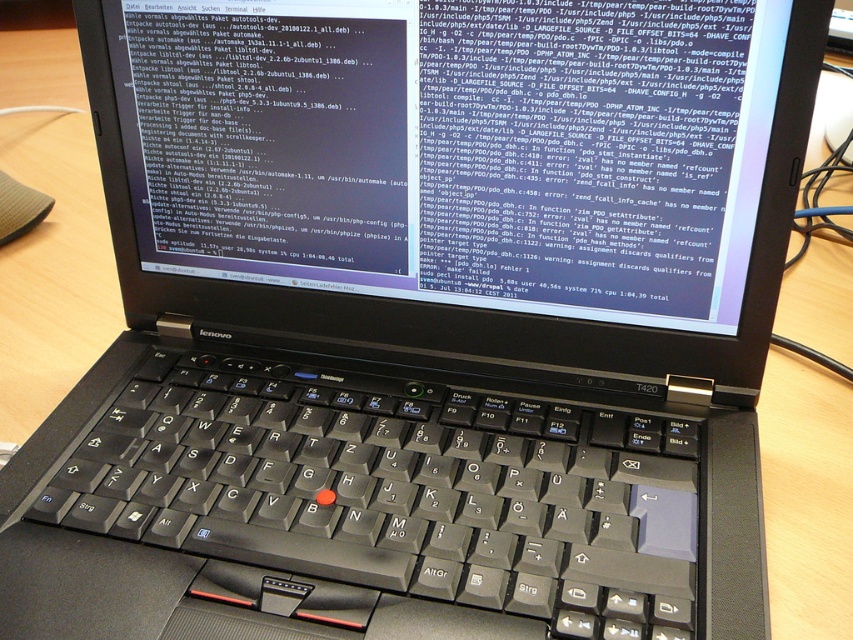
Which of these two, black glossy screen at upper center or black matte keyboard at center, stands taller?

Standing taller between the two is black glossy screen at upper center.

Who is more forward, (169, 51) or (308, 445)?

Point (308, 445)

Find the location of `black glossy screen at upper center`. black glossy screen at upper center is located at coordinates (456, 148).